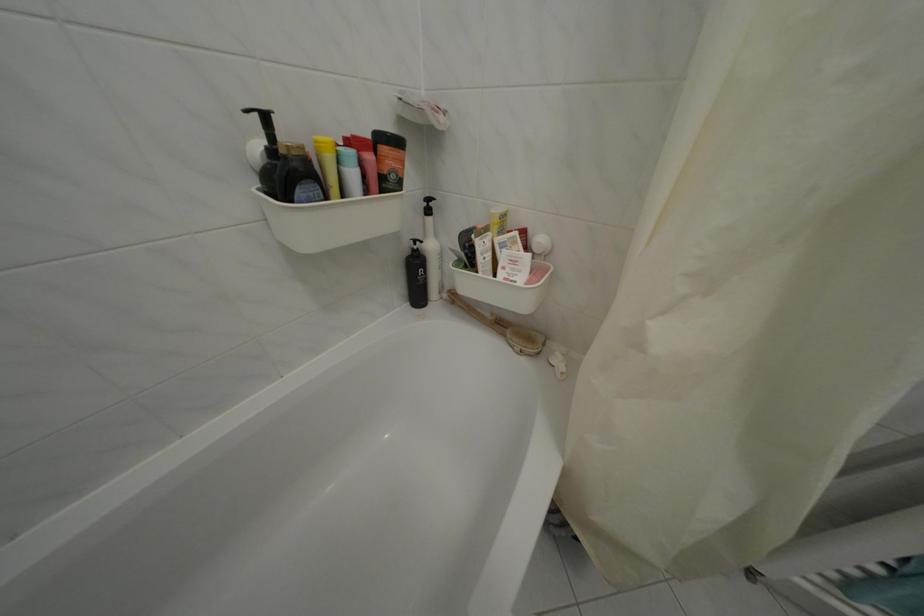
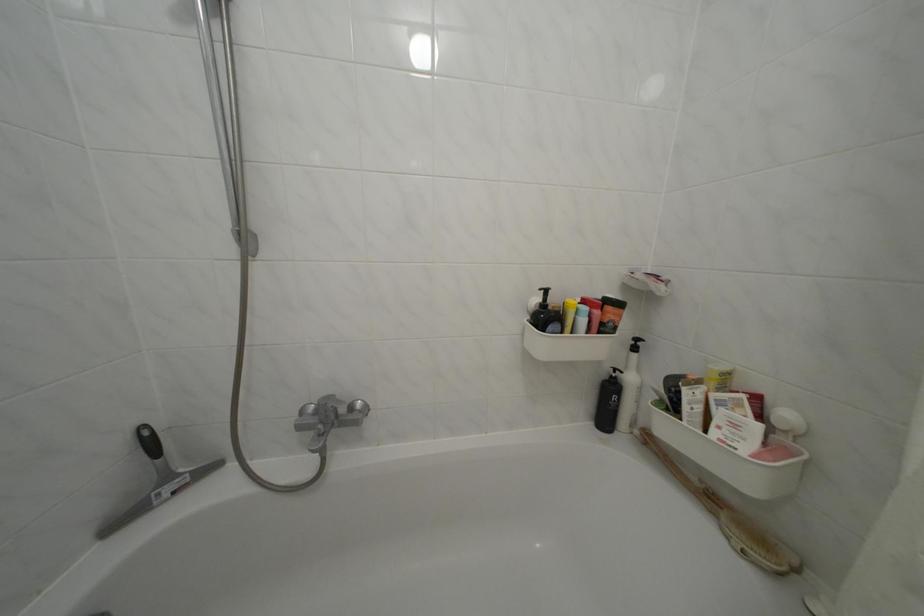
The point at (454, 302) is marked in the first image. Where is the corresponding point in the second image?

(646, 438)